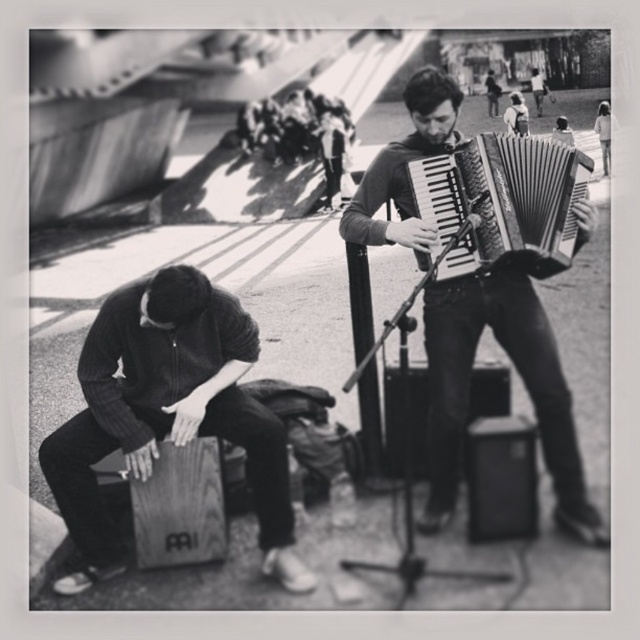
Is metallic accordion at center positioned before metallic silver accordion at center?

That is False.

Does metallic accordion at center have a smaller size compared to metallic silver accordion at center?

No.

You are a GUI agent. You are given a task and a screenshot of the screen. Output one action in this format:
    pyautogui.click(x=<x>, y=<y>)
    Task: Click on the metallic accordion at center
    Image resolution: width=640 pixels, height=640 pixels.
    Given the screenshot: What is the action you would take?
    pyautogui.click(x=522, y=378)

At what (x,y) coordinates should I click in order to perform the action: click on metallic accordion at center. Please return your answer as a coordinate pair (x, y). This screenshot has height=640, width=640. Looking at the image, I should click on (522, 378).

What do you see at coordinates (168, 413) in the screenshot?
I see `wooden cajon at lower left` at bounding box center [168, 413].

Is wooden cajon at lower left further to camera compared to metallic silver accordion at center?

Yes, wooden cajon at lower left is behind metallic silver accordion at center.

Locate an element on the screen. wooden cajon at lower left is located at coordinates click(168, 413).

Can you confirm if wooden cajon at lower left is shorter than metallic accordion at center?

Indeed, wooden cajon at lower left has a lesser height compared to metallic accordion at center.

What do you see at coordinates (168, 413) in the screenshot? I see `wooden cajon at lower left` at bounding box center [168, 413].

This screenshot has width=640, height=640. Describe the element at coordinates (168, 413) in the screenshot. I see `wooden cajon at lower left` at that location.

This screenshot has width=640, height=640. In order to click on wooden cajon at lower left in this screenshot , I will do `click(168, 413)`.